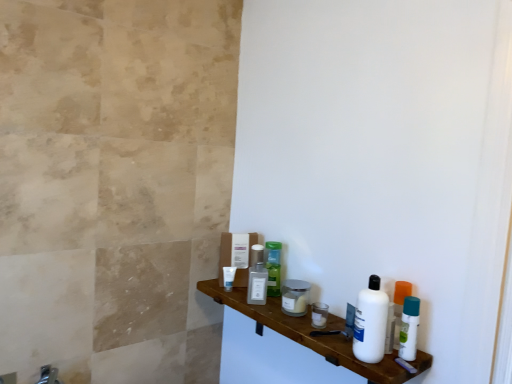
Find the location of a particular element. The height and width of the screenshot is (384, 512). free space above white glossy wood shelf at lower right (from a real-world perspective) is located at coordinates (297, 324).